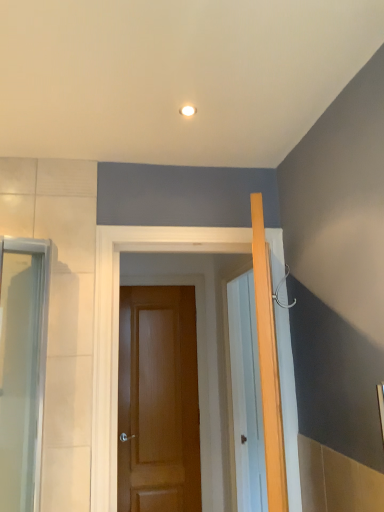
Question: Considering the positions of point (135, 382) and point (8, 358), is point (135, 382) closer or farther from the camera than point (8, 358)?

Choices:
 (A) closer
 (B) farther

Answer: (B)

Question: Would you say glossy wood door at center, marked as the second door in a front-to-back arrangement, is inside or outside clear glass screen door at left?

Choices:
 (A) outside
 (B) inside

Answer: (A)

Question: Which object is the closest to the brown wooden door at center, which is the first door in front-to-back order?

Choices:
 (A) glossy wood door at center, positioned as the 1th door in back-to-front order
 (B) clear glass screen door at left

Answer: (B)

Question: Estimate the real-world distances between objects in this image. Which object is closer to the brown wooden door at center, which is the first door in front-to-back order?

Choices:
 (A) glossy wood door at center, marked as the second door in a front-to-back arrangement
 (B) clear glass screen door at left

Answer: (B)